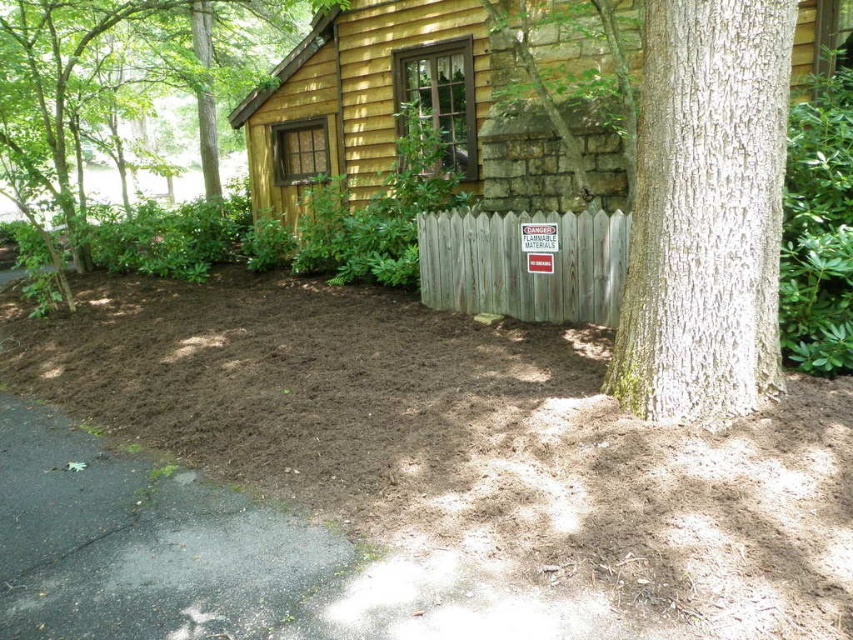
Is white textured bark at center shorter than brown textured tree at left?

Incorrect, white textured bark at center's height does not fall short of brown textured tree at left's.

Does white textured bark at center have a smaller size compared to brown textured tree at left?

Incorrect, white textured bark at center is not smaller in size than brown textured tree at left.

Is point (779, 134) positioned behind point (41, 161)?

That is False.

This screenshot has width=853, height=640. In order to click on white textured bark at center in this screenshot , I will do `click(705, 212)`.

Is wooden cabin at center thinner than white textured bark at center?

Incorrect, wooden cabin at center's width is not less than white textured bark at center's.

Measure the distance from wooden cabin at center to white textured bark at center.

A distance of 4.83 meters exists between wooden cabin at center and white textured bark at center.

Who is more distant from viewer, [366,74] or [775,348]?

The point [366,74] is more distant.

In order to click on wooden cabin at center in this screenshot , I will do `click(439, 104)`.

Is wooden cabin at center to the right of weathered wood fence at center from the viewer's perspective?

Incorrect, wooden cabin at center is not on the right side of weathered wood fence at center.

Is point (494, 90) closer to viewer compared to point (531, 298)?

No.

The width and height of the screenshot is (853, 640). Identify the location of wooden cabin at center. (439, 104).